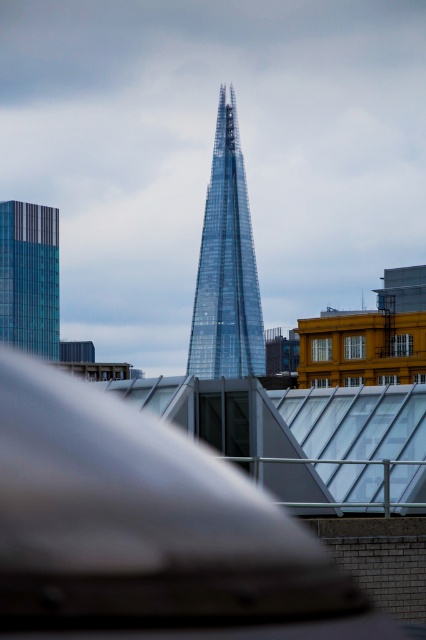
You are a city planner assessing the skyline. You need to determine if the transparent glass tower at center is taller than the glassy teal skyscraper at left. Based on the provided scene, what can you conclude?

The transparent glass tower at center has a greater height compared to the glassy teal skyscraper at left, so it is taller.

You are a city planner analyzing the skyline. Based on the image, which object is wider, the transparent glass tower at center or the glassy teal skyscraper at left?

The transparent glass tower at center might be wider than glassy teal skyscraper at left according to the description.

You are standing in the city looking at the skyscrapers. There are two points marked on the ground in front of you. The first point is at coordinates point (224, 284) and the second point is at point (2, 300). If you want to place a small flag at the point that is closer to you, which point should you choose?

You should place the flag at point (224, 284) because it is closer to the viewer than point (2, 300) according to the description.